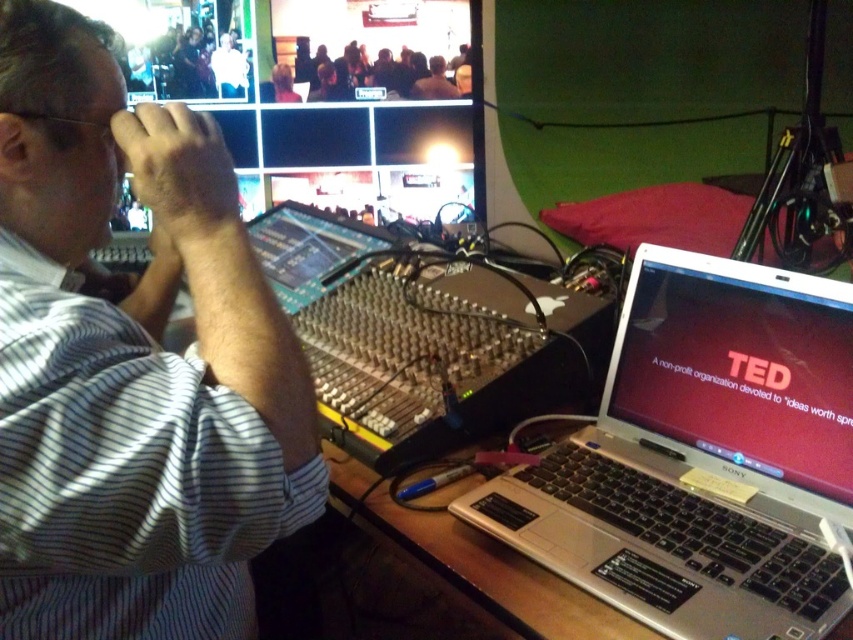
You are an event technician who needs to place a new device between the white striped shirt at upper left and the silver metallic laptop at right. Considering their sizes, which object should you place closer to the edge of the desk to avoid overcrowding?

The white striped shirt at upper left is larger than the silver metallic laptop at right, so you should place the larger white striped shirt at upper left closer to the edge to provide more space for the smaller laptop.

You are a stagehand at a live event and need to locate the white striped shirt at upper left. Where exactly is it positioned on the screen?

The white striped shirt at upper left is positioned at point (132, 364) on the screen.